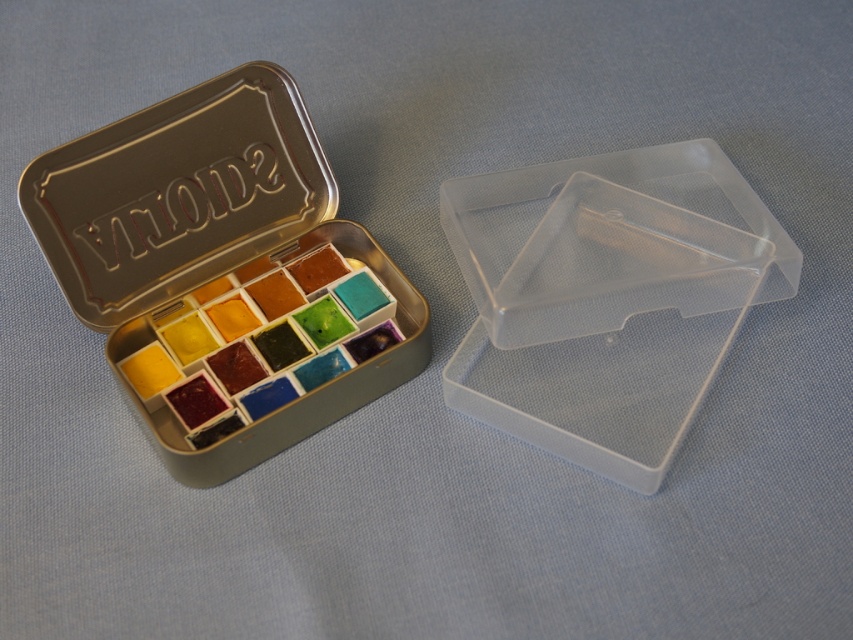
You are an artist who needs to store your metallic tin at upper left and transparent plastic box at center. Based on the scene, which container is taller?

The metallic tin at upper left is taller than the transparent plastic box at center according to the description.

You need to pack both the metallic tin at upper left and the transparent plastic box at center into a storage container. Which one should you place first to ensure both fit properly?

You should place the metallic tin at upper left first because it is larger than the transparent plastic box at center, allowing you to fit both items by placing the smaller one on top or beside the larger one.